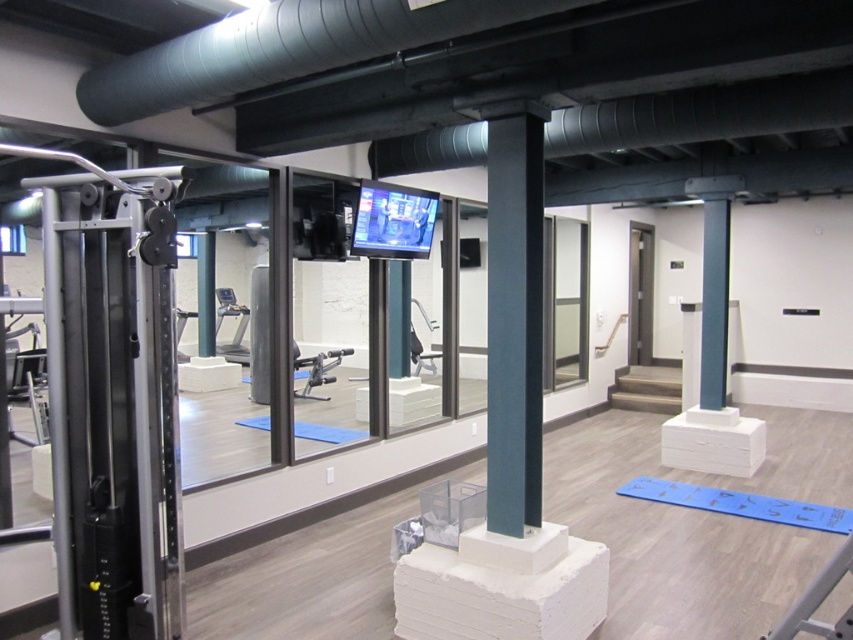
Question: Which object is closer to the camera taking this photo?

Choices:
 (A) satin dark green pole at center
 (B) flat screen monitor at center

Answer: (A)

Question: Does satin dark green pole at center come in front of flat screen monitor at center?

Choices:
 (A) yes
 (B) no

Answer: (A)

Question: Can you confirm if satin dark green pole at center is smaller than flat screen monitor at center?

Choices:
 (A) no
 (B) yes

Answer: (B)

Question: Does satin dark green pole at center have a greater width compared to flat screen monitor at center?

Choices:
 (A) no
 (B) yes

Answer: (A)

Question: Which object is farther from the camera taking this photo?

Choices:
 (A) flat screen monitor at center
 (B) satin dark green pole at center

Answer: (A)